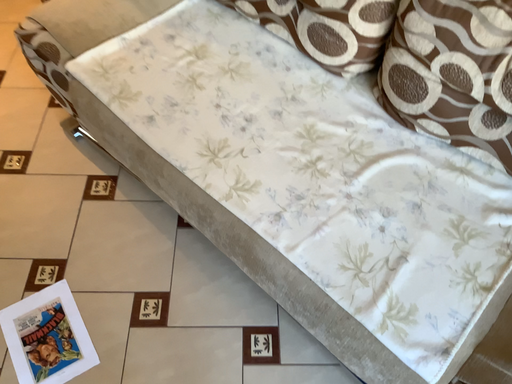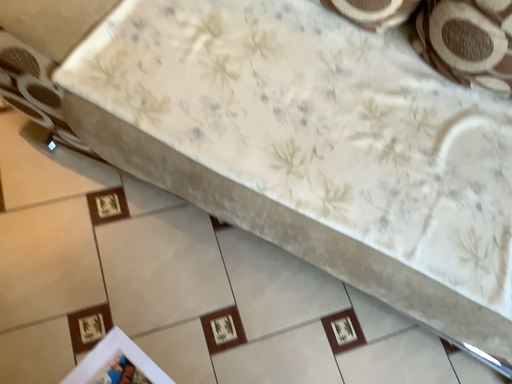
Question: How did the camera likely rotate when shooting the video?

Choices:
 (A) rotated downward
 (B) rotated upward

Answer: (A)